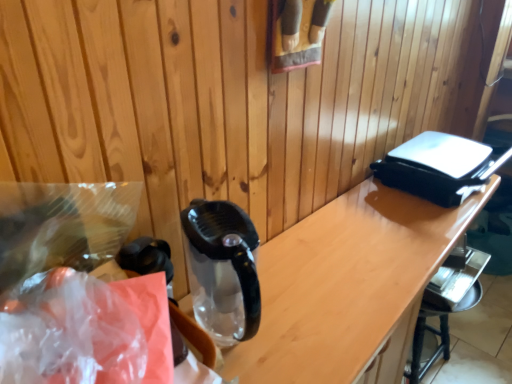
Question: Does translucent plastic bag at left come behind transparent plastic bag at left?

Choices:
 (A) no
 (B) yes

Answer: (A)

Question: Can you confirm if translucent plastic bag at left is taller than transparent plastic bag at left?

Choices:
 (A) no
 (B) yes

Answer: (A)

Question: From a real-world perspective, is translucent plastic bag at left under transparent plastic bag at left?

Choices:
 (A) yes
 (B) no

Answer: (B)

Question: From the image's perspective, does translucent plastic bag at left appear lower than transparent plastic bag at left?

Choices:
 (A) no
 (B) yes

Answer: (A)

Question: Is translucent plastic bag at left with transparent plastic bag at left?

Choices:
 (A) yes
 (B) no

Answer: (A)

Question: Is transparent plastic bag at left surrounded by translucent plastic bag at left?

Choices:
 (A) yes
 (B) no

Answer: (B)

Question: Is translucent plastic bag at left oriented away from metallic silver bar stool at lower right?

Choices:
 (A) yes
 (B) no

Answer: (B)

Question: Considering the relative sizes of translucent plastic bag at left and metallic silver bar stool at lower right in the image provided, is translucent plastic bag at left shorter than metallic silver bar stool at lower right?

Choices:
 (A) no
 (B) yes

Answer: (B)

Question: From a real-world perspective, is translucent plastic bag at left positioned under metallic silver bar stool at lower right based on gravity?

Choices:
 (A) yes
 (B) no

Answer: (B)

Question: Would you say metallic silver bar stool at lower right is part of translucent plastic bag at left's contents?

Choices:
 (A) no
 (B) yes

Answer: (A)

Question: Is translucent plastic bag at left to the left of metallic silver bar stool at lower right from the viewer's perspective?

Choices:
 (A) no
 (B) yes

Answer: (B)

Question: From the image's perspective, is translucent plastic bag at left on metallic silver bar stool at lower right?

Choices:
 (A) yes
 (B) no

Answer: (A)

Question: From a real-world perspective, is transparent plastic bag at left located beneath translucent plastic bag at left?

Choices:
 (A) yes
 (B) no

Answer: (A)